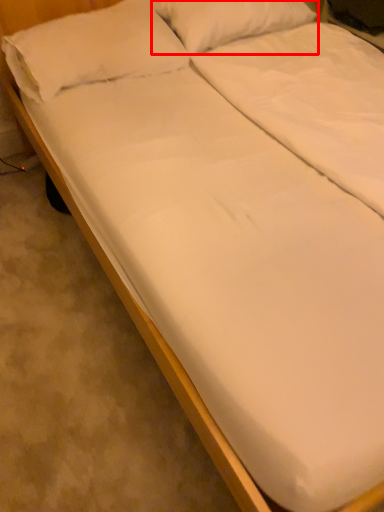
Question: From the image's perspective, where is pillow (annotated by the red box) located in relation to pillow in the image?

Choices:
 (A) above
 (B) below

Answer: (A)